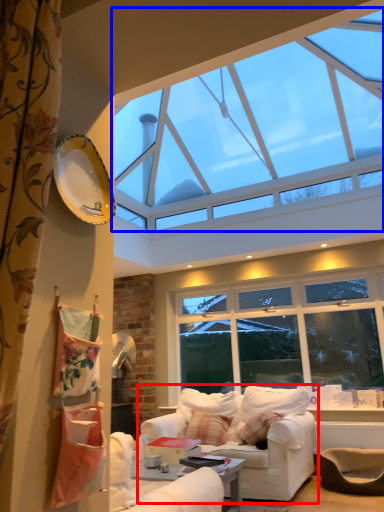
Question: Which object is further to the camera taking this photo, studio couch (highlighted by a red box) or window (highlighted by a blue box)?

Choices:
 (A) studio couch
 (B) window

Answer: (A)